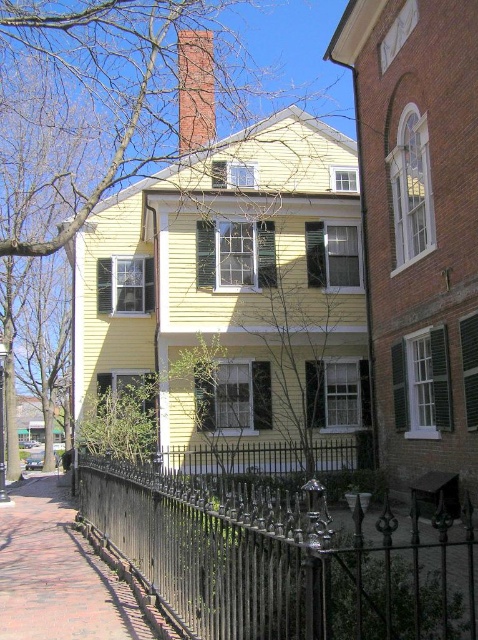
Between green leafy tree at upper left and brick chimney at upper center, which one appears on the right side from the viewer's perspective?

Positioned to the right is brick chimney at upper center.

Can you confirm if green leafy tree at upper left is bigger than brick chimney at upper center?

Yes, green leafy tree at upper left is bigger than brick chimney at upper center.

The width and height of the screenshot is (478, 640). Describe the element at coordinates (293, 54) in the screenshot. I see `green leafy tree at upper left` at that location.

You are a GUI agent. You are given a task and a screenshot of the screen. Output one action in this format:
    pyautogui.click(x=<x>, y=<y>)
    Task: Click on the green leafy tree at upper left
    The height and width of the screenshot is (640, 478).
    Given the screenshot: What is the action you would take?
    pyautogui.click(x=293, y=54)

Is brick pavement at lower left below brick chimney at upper center?

Yes.

Is brick pavement at lower left bigger than brick chimney at upper center?

Correct, brick pavement at lower left is larger in size than brick chimney at upper center.

Does point (87, 589) come behind point (208, 138)?

No, (87, 589) is closer to viewer.

Where is `brick pavement at lower left`? Image resolution: width=478 pixels, height=640 pixels. brick pavement at lower left is located at coordinates (58, 573).

Which is more to the right, dark brown wrought iron fence at lower left or brick chimney at upper center?

From the viewer's perspective, dark brown wrought iron fence at lower left appears more on the right side.

Does point (254, 625) lie behind point (185, 44)?

No, (254, 625) is closer to viewer.

Between point (264, 547) and point (189, 134), which one is positioned in front?

Point (264, 547)

Find the location of a particular element. dark brown wrought iron fence at lower left is located at coordinates (279, 560).